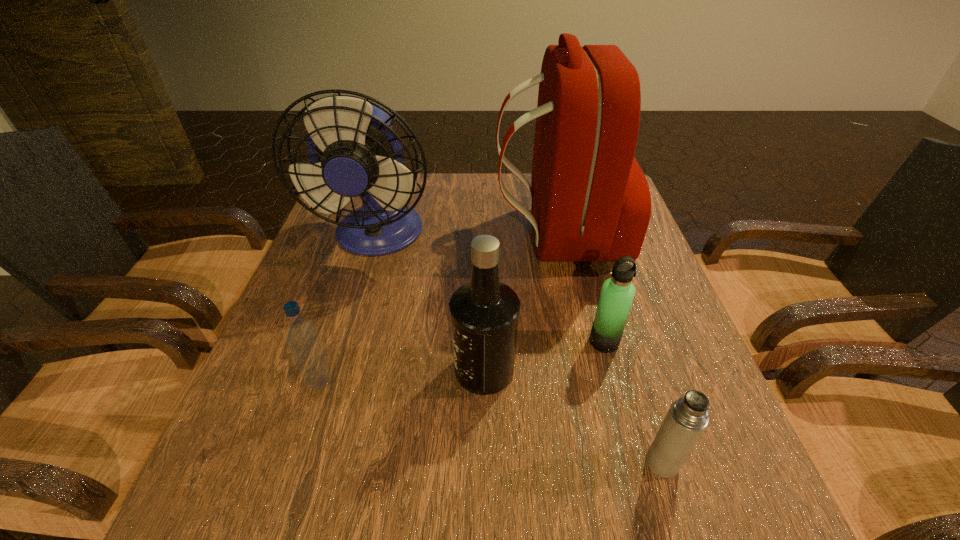
Identify the location of vacant area that satisfies the following two spatial constraints: 1. on the front label of the liquor; 2. on the left side of the nearer thermos bottle. (485, 463).

Locate an element on the screen. This screenshot has width=960, height=540. free spot that satisfies the following two spatial constraints: 1. on the strap side of the nearest object; 2. on the right side of the backpack is located at coordinates (605, 463).

You are a GUI agent. You are given a task and a screenshot of the screen. Output one action in this format:
    pyautogui.click(x=<x>, y=<y>)
    Task: Click on the free space that satisfies the following two spatial constraints: 1. on the front label of the liquor; 2. on the right side of the nearest object
    Image resolution: width=960 pixels, height=540 pixels.
    Given the screenshot: What is the action you would take?
    [485, 463]